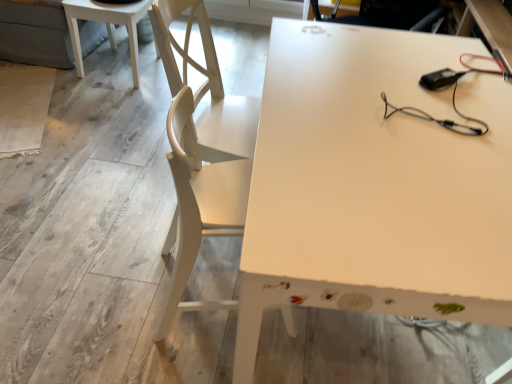
Question: Considering the relative positions of white glossy table at upper left, the first table positioned from the left, and white matte table at center, the 1th table ordered from the bottom, in the image provided, is white glossy table at upper left, the first table positioned from the left, to the left of white matte table at center, the 1th table ordered from the bottom, from the viewer's perspective?

Choices:
 (A) yes
 (B) no

Answer: (A)

Question: From a real-world perspective, is white glossy table at upper left, the first table in the top-to-bottom sequence, over white matte table at center, arranged as the 2th table when viewed from the top?

Choices:
 (A) yes
 (B) no

Answer: (B)

Question: From the image's perspective, is white glossy table at upper left, the first table positioned from the left, over white matte table at center, the 1th table viewed from the right?

Choices:
 (A) yes
 (B) no

Answer: (A)

Question: Is the surface of white glossy table at upper left, the 2th table in the right-to-left sequence, in direct contact with white matte table at center, the 1th table viewed from the right?

Choices:
 (A) yes
 (B) no

Answer: (B)

Question: Are white glossy table at upper left, placed as the second table when sorted from front to back, and white matte table at center, arranged as the 2th table when viewed from the top, far apart?

Choices:
 (A) yes
 (B) no

Answer: (A)

Question: Choose the correct answer: Is white wood chair at left inside white glossy table at upper left, the first table positioned from the left, or outside it?

Choices:
 (A) inside
 (B) outside

Answer: (B)

Question: Considering the positions of white wood chair at left and white glossy table at upper left, the second table in the bottom-to-top sequence, in the image, is white wood chair at left taller or shorter than white glossy table at upper left, the second table in the bottom-to-top sequence,?

Choices:
 (A) short
 (B) tall

Answer: (B)

Question: From a real-world perspective, is white wood chair at left positioned above or below white glossy table at upper left, placed as the second table when sorted from front to back?

Choices:
 (A) below
 (B) above

Answer: (B)

Question: In the image, is white wood chair at left on the left side or the right side of white glossy table at upper left, the 2th table in the right-to-left sequence?

Choices:
 (A) left
 (B) right

Answer: (B)

Question: In terms of size, does white matte table at center, the 1th table ordered from the bottom, appear bigger or smaller than white wood chair at left?

Choices:
 (A) small
 (B) big

Answer: (B)

Question: From a real-world perspective, is white matte table at center, which is counted as the second table, starting from the left, positioned above or below white wood chair at left?

Choices:
 (A) above
 (B) below

Answer: (B)

Question: In the image, is white matte table at center, arranged as the 2th table when viewed from the top, positioned in front of or behind white wood chair at left?

Choices:
 (A) front
 (B) behind

Answer: (A)

Question: Do you think white matte table at center, the 1th table viewed from the right, is within white wood chair at left, or outside of it?

Choices:
 (A) outside
 (B) inside

Answer: (A)

Question: Is white glossy table at upper left, acting as the first table starting from the back, bigger or smaller than white matte table at center, the 1th table positioned from the front?

Choices:
 (A) small
 (B) big

Answer: (A)

Question: From their relative heights in the image, would you say white glossy table at upper left, the first table in the top-to-bottom sequence, is taller or shorter than white matte table at center, arranged as the 2th table when viewed from the top?

Choices:
 (A) short
 (B) tall

Answer: (A)